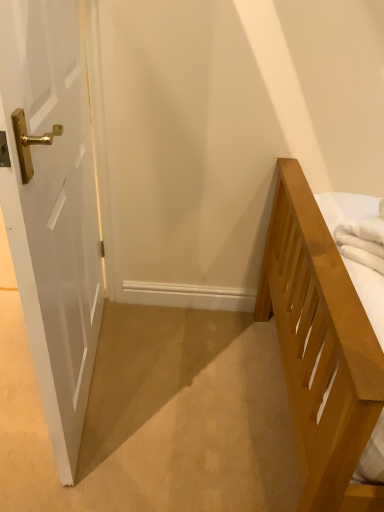
Question: Does white glossy door at left touch white soft towel at right?

Choices:
 (A) no
 (B) yes

Answer: (A)

Question: Does white glossy door at left have a lesser height compared to white soft towel at right?

Choices:
 (A) yes
 (B) no

Answer: (B)

Question: Considering the relative positions of white glossy door at left and white soft towel at right in the image provided, is white glossy door at left to the left of white soft towel at right from the viewer's perspective?

Choices:
 (A) yes
 (B) no

Answer: (A)

Question: From the image's perspective, is white glossy door at left located beneath white soft towel at right?

Choices:
 (A) yes
 (B) no

Answer: (B)

Question: Is the depth of white glossy door at left greater than that of white soft towel at right?

Choices:
 (A) no
 (B) yes

Answer: (A)

Question: Is white glossy door at left at the right side of white soft towel at right?

Choices:
 (A) no
 (B) yes

Answer: (A)

Question: From a real-world perspective, is white soft towel at right positioned under white glossy door at left based on gravity?

Choices:
 (A) yes
 (B) no

Answer: (B)

Question: Is white soft towel at right in contact with white glossy door at left?

Choices:
 (A) no
 (B) yes

Answer: (A)

Question: From a real-world perspective, is white soft towel at right physically above white glossy door at left?

Choices:
 (A) no
 (B) yes

Answer: (B)

Question: Are white soft towel at right and white glossy door at left far apart?

Choices:
 (A) yes
 (B) no

Answer: (B)

Question: Considering the relative sizes of white soft towel at right and white glossy door at left in the image provided, is white soft towel at right bigger than white glossy door at left?

Choices:
 (A) yes
 (B) no

Answer: (B)

Question: Is white soft towel at right taller than white glossy door at left?

Choices:
 (A) no
 (B) yes

Answer: (A)

Question: Is white glossy door at left situated inside white soft towel at right or outside?

Choices:
 (A) outside
 (B) inside

Answer: (A)